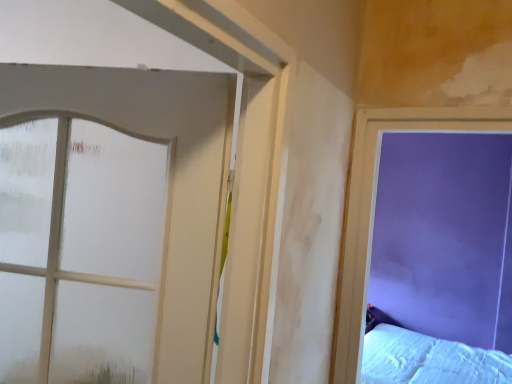
You are a GUI agent. You are given a task and a screenshot of the screen. Output one action in this format:
    pyautogui.click(x=<x>, y=<y>)
    Task: Click on the white painted wood door at left
    This screenshot has width=512, height=384.
    Given the screenshot: What is the action you would take?
    pyautogui.click(x=173, y=178)

This screenshot has height=384, width=512. Describe the element at coordinates (173, 178) in the screenshot. I see `white painted wood door at left` at that location.

Where is `white painted wood door at left`? The height and width of the screenshot is (384, 512). white painted wood door at left is located at coordinates (173, 178).